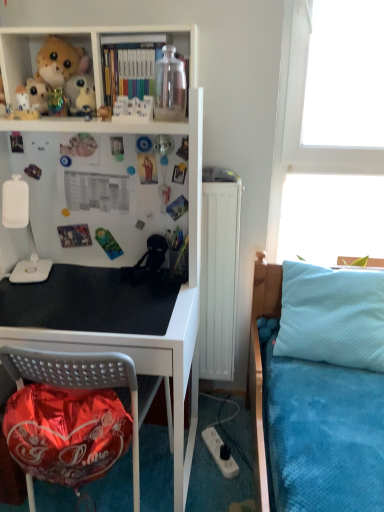
Find the location of a particular element. The height and width of the screenshot is (512, 384). spots to the right of white plastic lamp at left is located at coordinates coord(78,278).